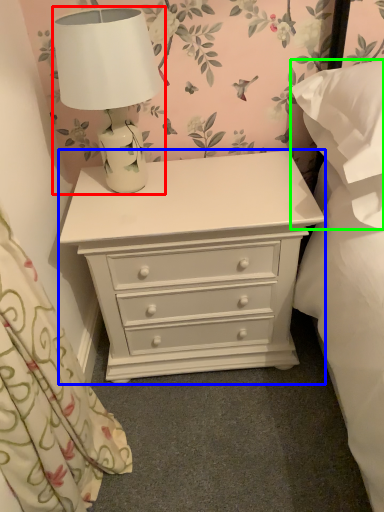
Question: Estimate the real-world distances between objects in this image. Which object is farther from lamp (highlighted by a red box), chest of drawers (highlighted by a blue box) or pillow (highlighted by a green box)?

Choices:
 (A) chest of drawers
 (B) pillow

Answer: (B)